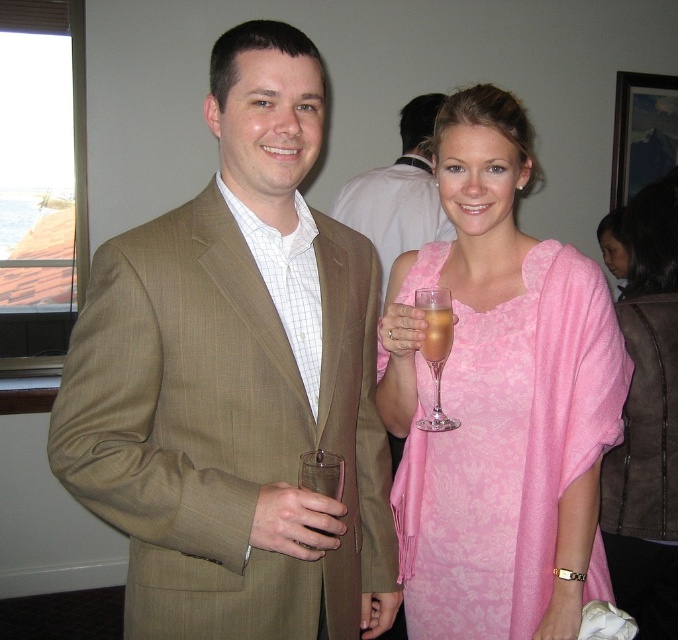
Question: Is clear glass wine glass at center positioned before clear glass at center?

Choices:
 (A) yes
 (B) no

Answer: (B)

Question: Which is nearer to the pink suede vest at right?

Choices:
 (A) matte brown suit at center
 (B) tan pinstripe suit at center
 (C) clear glass at center
 (D) translucent glass at center

Answer: (A)

Question: Which point is closer to the camera?

Choices:
 (A) matte brown suit at center
 (B) pink suede vest at right

Answer: (B)

Question: Is clear glass wine glass at center bigger than clear glass at center?

Choices:
 (A) no
 (B) yes

Answer: (B)

Question: Does pink damask fabric dress at center have a lesser width compared to clear glass wine glass at center?

Choices:
 (A) yes
 (B) no

Answer: (B)

Question: Which object is farther from the camera taking this photo?

Choices:
 (A) matte brown suit at center
 (B) pink damask fabric dress at center

Answer: (A)